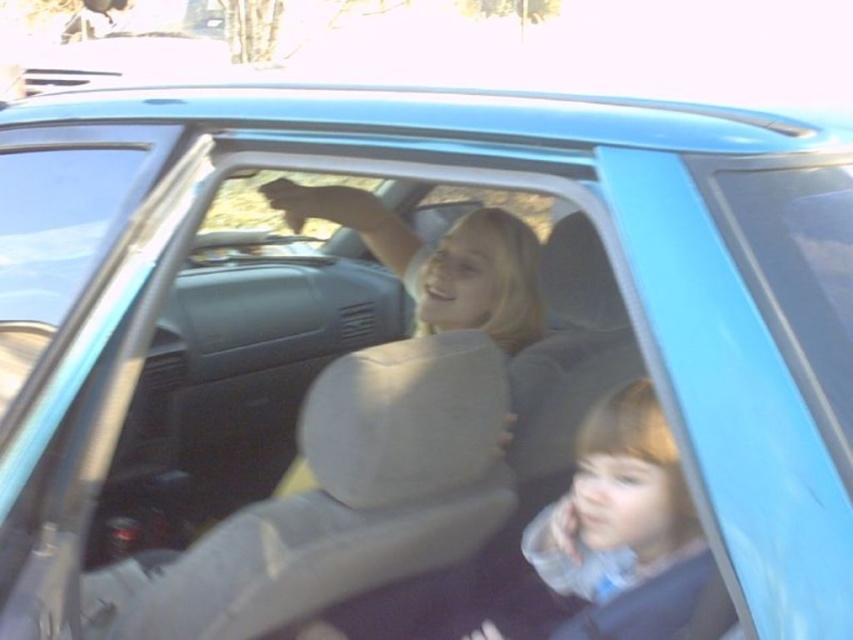
Question: Which point is farther from the camera taking this photo?

Choices:
 (A) (537, 259)
 (B) (541, 547)

Answer: (A)

Question: Which object appears farthest from the camera in this image?

Choices:
 (A) light beige leather seat at center
 (B) smooth beige baby at center

Answer: (A)

Question: Can you confirm if smooth beige baby at center is positioned above light beige leather seat at center?

Choices:
 (A) yes
 (B) no

Answer: (B)

Question: Does smooth beige baby at center appear over light beige leather seat at center?

Choices:
 (A) no
 (B) yes

Answer: (A)

Question: Does smooth beige baby at center appear on the right side of light beige leather seat at center?

Choices:
 (A) yes
 (B) no

Answer: (A)